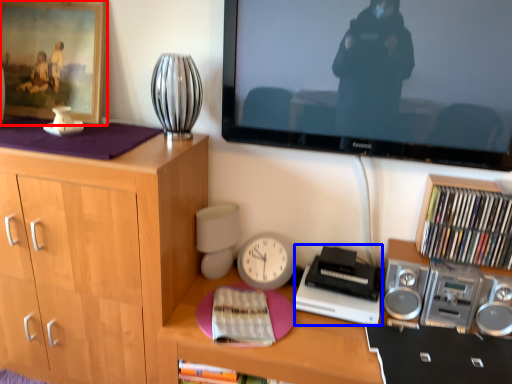
Question: Which of the following is the farthest to the observer, picture frame (highlighted by a red box) or equipment (highlighted by a blue box)?

Choices:
 (A) picture frame
 (B) equipment

Answer: (A)